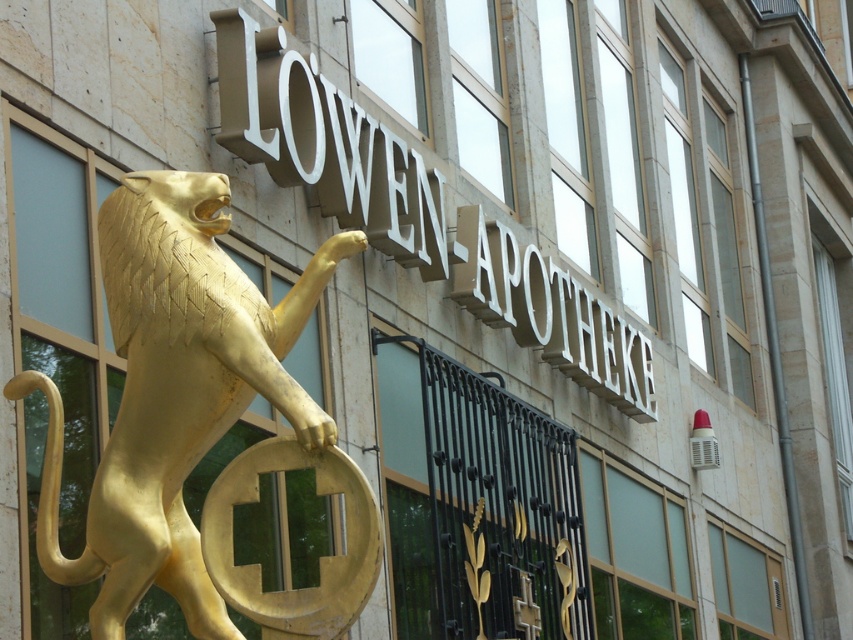
You are an architect designing a new pharmacy and want to replicate the LION APOTHEKE design. You have two golden elements to place on the facade. The gold polished lion at left and the matte gold sign at upper center. Which element is narrower in width?

The gold polished lion at left is thinner than the matte gold sign at upper center, so the gold polished lion at left is narrower in width.

You are a visitor approaching the L?w.en Apotheke building and want to find the entrance. You see the gold polished lion at left and the matte gold sign at upper center. Which object is located to the left of the other?

The gold polished lion at left is positioned on the left side of matte gold sign at upper center, so the gold polished lion at left is to the left of the matte gold sign at upper center.